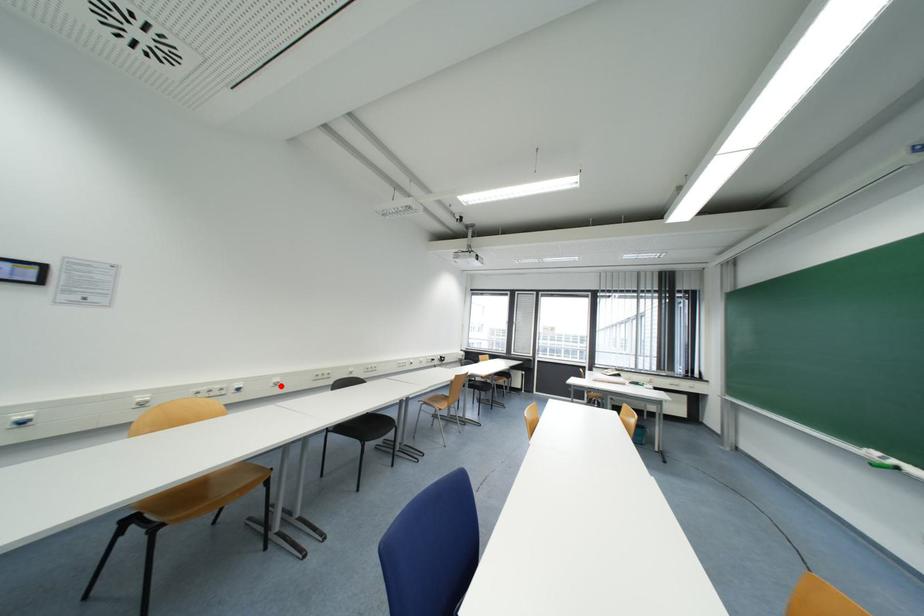
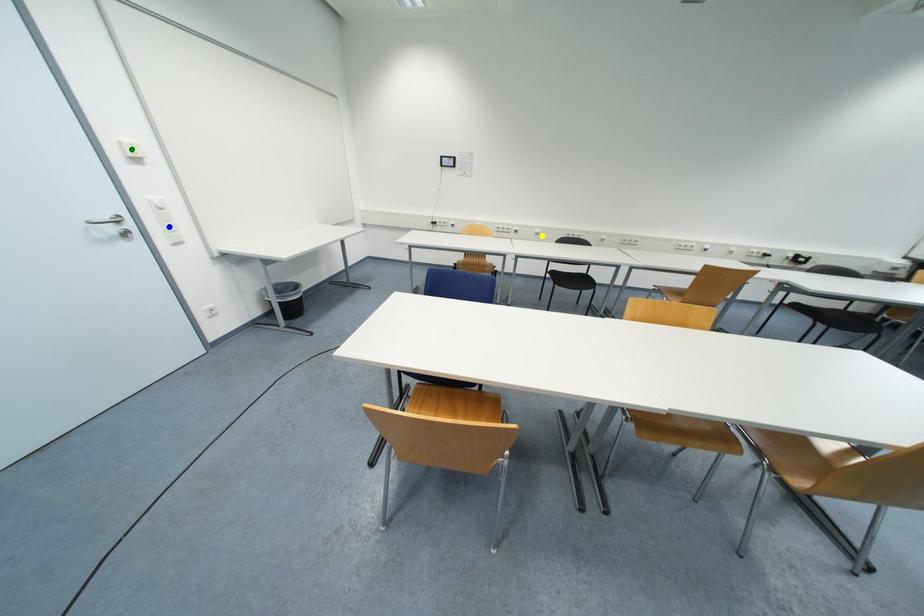
Question: I am providing you with two images of the same scene from different viewpoints. A red point is marked on the first image. You are given multiple points on the second image. In image 2, which mark is for the same physical point as the one in image 1?

Choices:
 (A) green point
 (B) blue point
 (C) yellow point

Answer: (C)